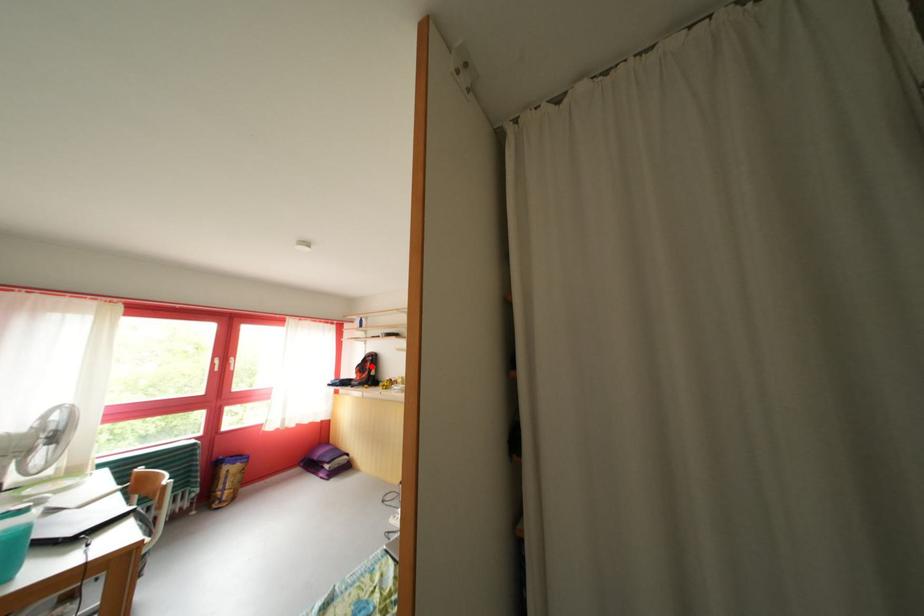
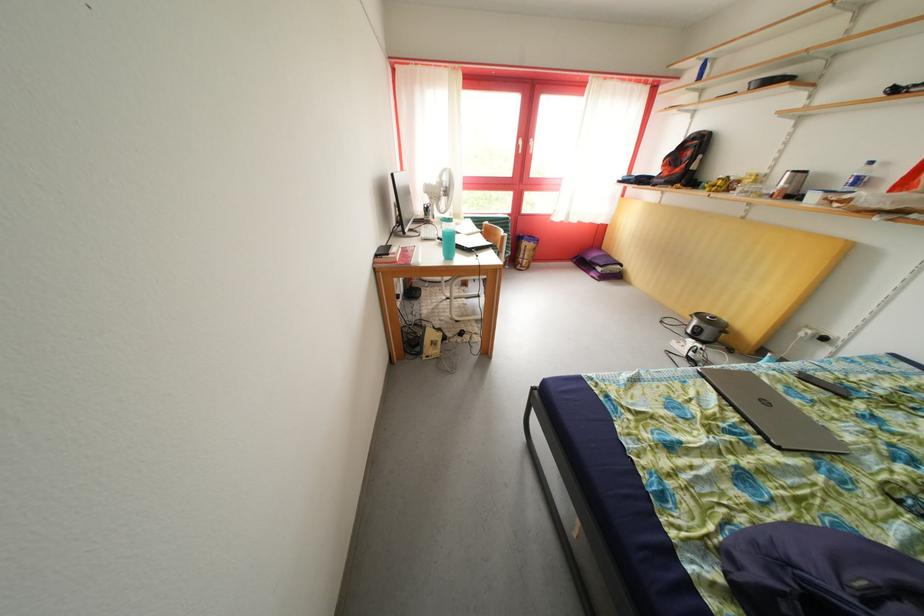
Question: I am providing you with two images of the same scene from different viewpoints. A red point is shown in image1. For the corresponding object point in image2, is it positioned nearer or farther from the camera?

Choices:
 (A) Nearer
 (B) Farther

Answer: (A)